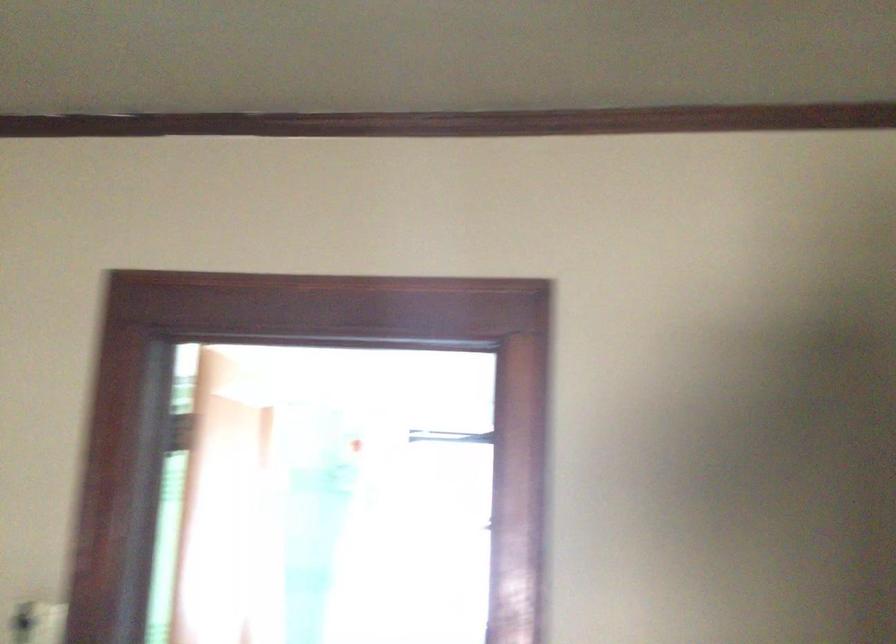
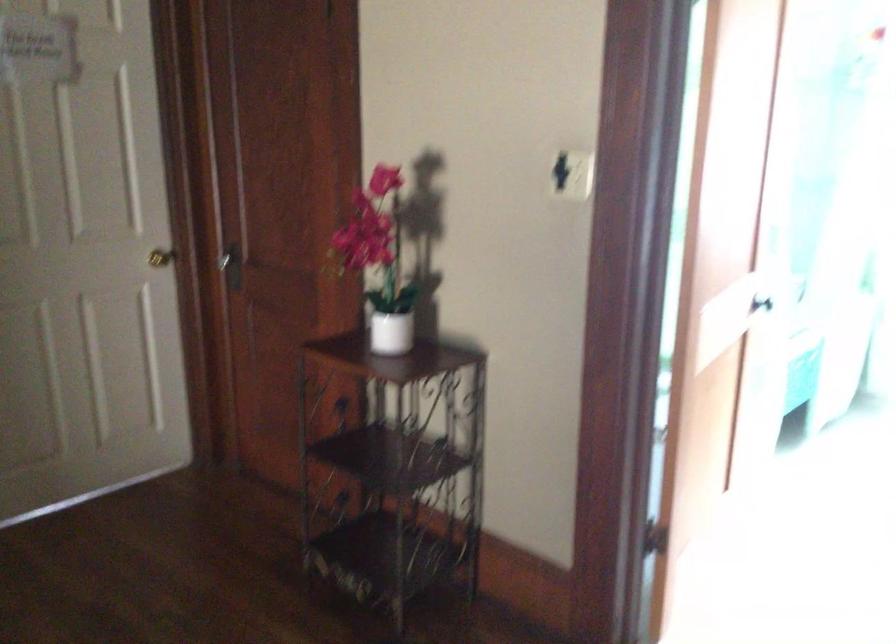
How did the camera likely rotate?

The camera rotated toward left-down.